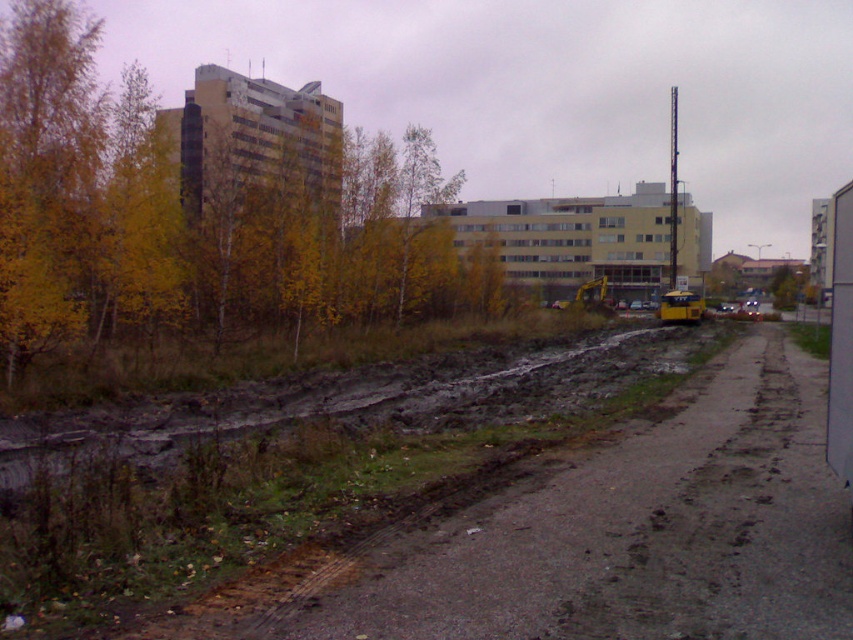
From the picture: Is yellow leafy trees at upper left positioned in front of muddy asphalt at lower left?

No, it is behind muddy asphalt at lower left.

Who is higher up, yellow leafy trees at upper left or muddy asphalt at lower left?

yellow leafy trees at upper left

Between point (65, 260) and point (433, 544), which one is positioned in front?

Point (433, 544) is more forward.

The height and width of the screenshot is (640, 853). I want to click on yellow leafy trees at upper left, so click(195, 205).